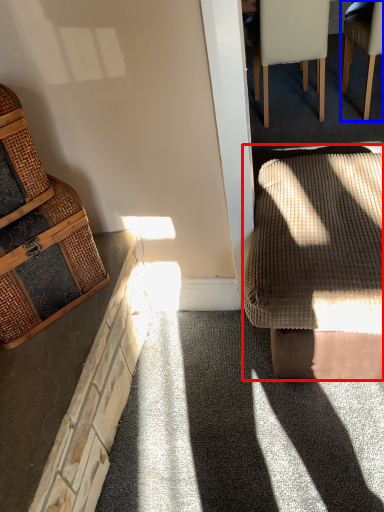
Question: Which point is closer to the camera, rocking chair (highlighted by a red box) or chair (highlighted by a blue box)?

Choices:
 (A) rocking chair
 (B) chair

Answer: (A)